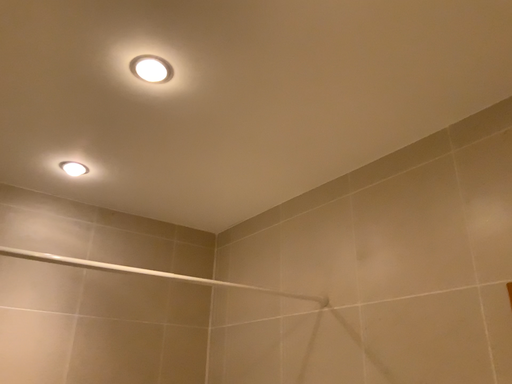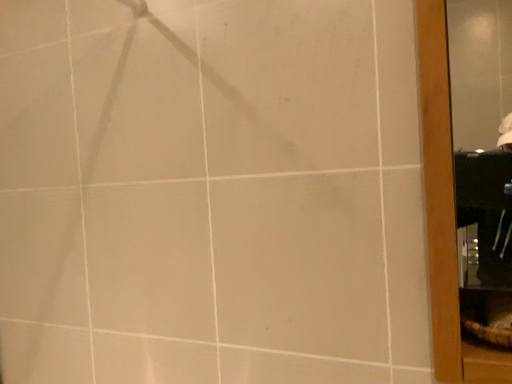
Question: How did the camera likely rotate when shooting the video?

Choices:
 (A) rotated right
 (B) rotated left

Answer: (A)